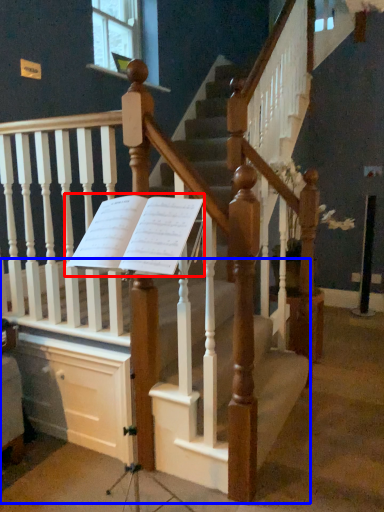
Question: Which object appears closest to the camera in this image, sheet music (highlighted by a red box) or stairs (highlighted by a blue box)?

Choices:
 (A) sheet music
 (B) stairs

Answer: (B)